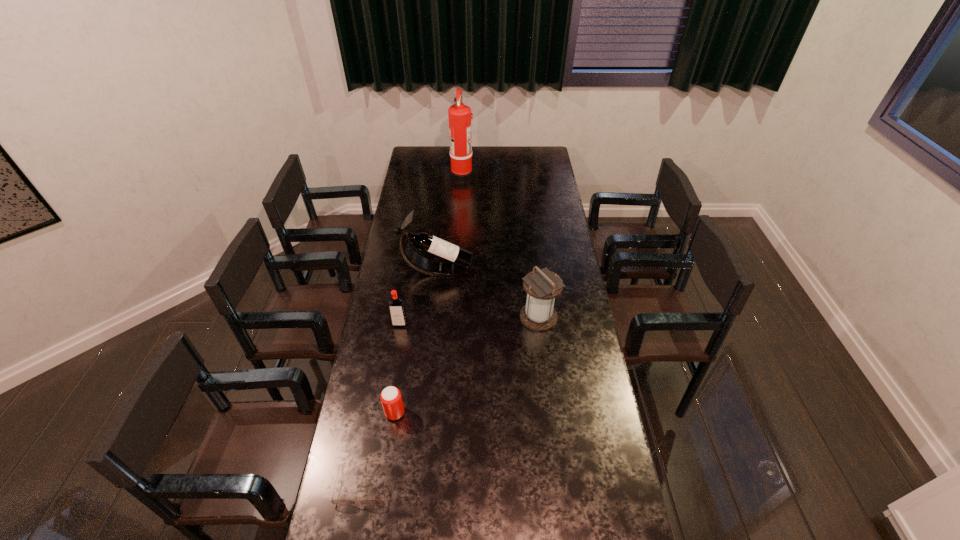
Find the location of `blank region between the third shortest object and the rightmost object`. blank region between the third shortest object and the rightmost object is located at coordinates click(469, 320).

This screenshot has height=540, width=960. What are the coordinates of `vacant space that's between the vodka and the nearest object` in the screenshot? It's located at (381, 404).

The height and width of the screenshot is (540, 960). I want to click on empty space that is in between the rightmost object and the shortest object, so click(x=450, y=401).

Find the location of a particular element. The height and width of the screenshot is (540, 960). free space between the fourth tallest object and the beer can is located at coordinates (397, 368).

The image size is (960, 540). What are the coordinates of `free spot between the vodka and the rightmost object` in the screenshot? It's located at (469, 320).

The width and height of the screenshot is (960, 540). Identify the location of free area in between the lantern and the third shortest object. coord(469,320).

What are the coordinates of `blank region between the second tallest object and the tallest object` in the screenshot? It's located at (449, 222).

Locate an element on the screen. Image resolution: width=960 pixels, height=540 pixels. free spot between the rightmost object and the second tallest object is located at coordinates (488, 293).

The height and width of the screenshot is (540, 960). Find the location of `object that is the fourth closest one to the fourth tallest object`. object that is the fourth closest one to the fourth tallest object is located at coordinates (339, 501).

Select which object is the closest to the beer can. Please provide its 2D coordinates. Your answer should be formatted as a tuple, i.e. [(x, y)], where the tuple contains the x and y coordinates of a point satisfying the conditions above.

[(339, 501)]